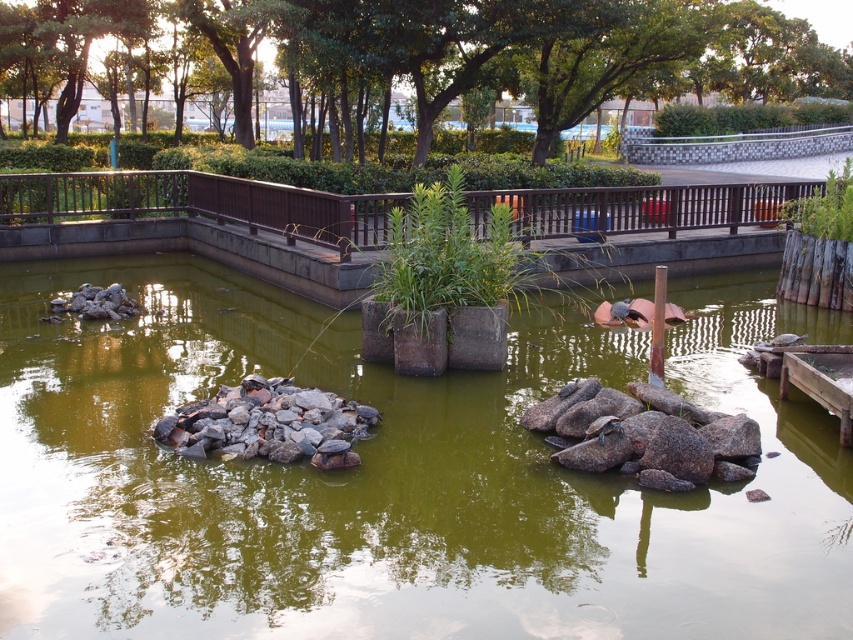
Question: Which point appears farthest from the camera in this image?

Choices:
 (A) (637, 442)
 (B) (100, 308)
 (C) (115, 403)

Answer: (B)

Question: Is brown rough rock at center above gray rock at left?

Choices:
 (A) no
 (B) yes

Answer: (A)

Question: Which point is farther to the camera?

Choices:
 (A) (653, 419)
 (B) (234, 365)
 (C) (85, 301)

Answer: (C)

Question: Is green murky water at center to the left of brown rough rock at center from the viewer's perspective?

Choices:
 (A) yes
 (B) no

Answer: (A)

Question: Can you confirm if green murky water at center is thinner than brown rough rock at center?

Choices:
 (A) yes
 (B) no

Answer: (B)

Question: Which object is closer to the camera taking this photo?

Choices:
 (A) brown rough rock at center
 (B) gray rock at center
 (C) gray rock at left
 (D) green murky water at center

Answer: (D)